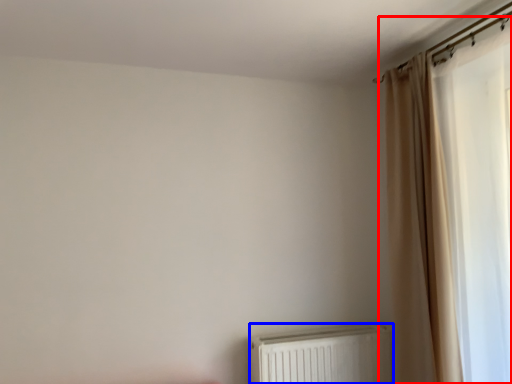
Question: Which point is further to the camera, curtain (highlighted by a red box) or radiator (highlighted by a blue box)?

Choices:
 (A) curtain
 (B) radiator

Answer: (B)